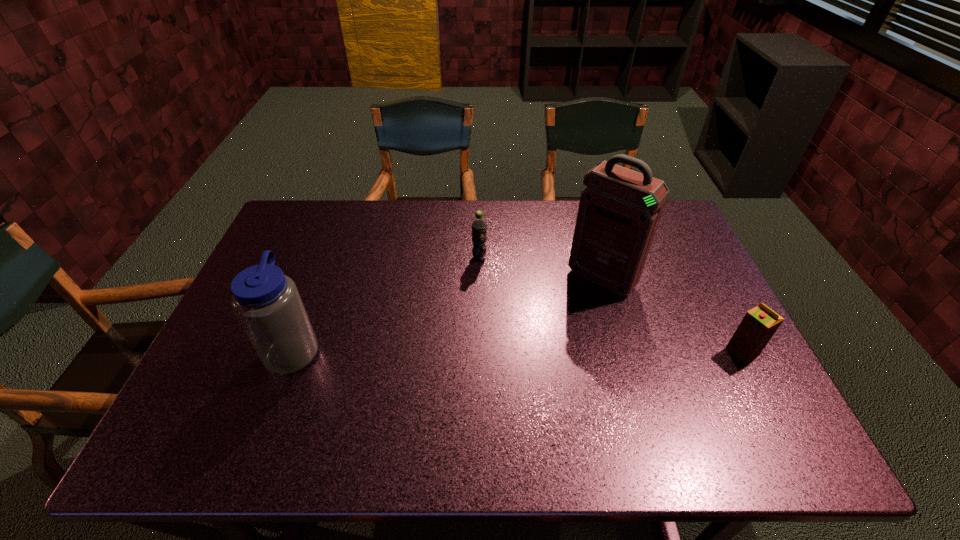
You are a GUI agent. You are given a task and a screenshot of the screen. Output one action in this format:
    pyautogui.click(x=<x>, y=<y>)
    Task: Click on the free spot between the soda and the third shortest object
    
    Given the screenshot: What is the action you would take?
    pyautogui.click(x=387, y=303)

This screenshot has height=540, width=960. Find the location of `object that can be found as the third closest to the orange juice`. object that can be found as the third closest to the orange juice is located at coordinates (266, 302).

Locate which object ranks in proximity to the soda. Please provide its 2D coordinates. Your answer should be formatted as a tuple, i.e. [(x, y)], where the tuple contains the x and y coordinates of a point satisfying the conditions above.

[(619, 211)]